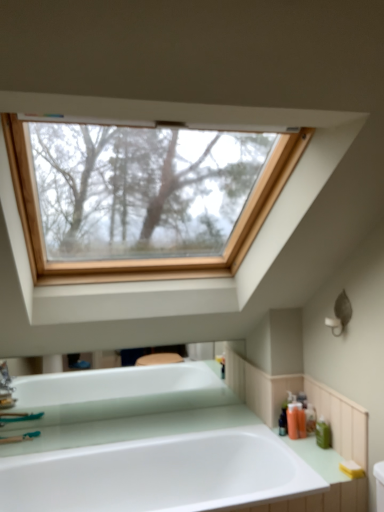
This screenshot has width=384, height=512. I want to click on vacant space that is to the left of green matte bottle at right, the 4th toiletry in the back-to-front sequence, so pyautogui.click(x=292, y=448).